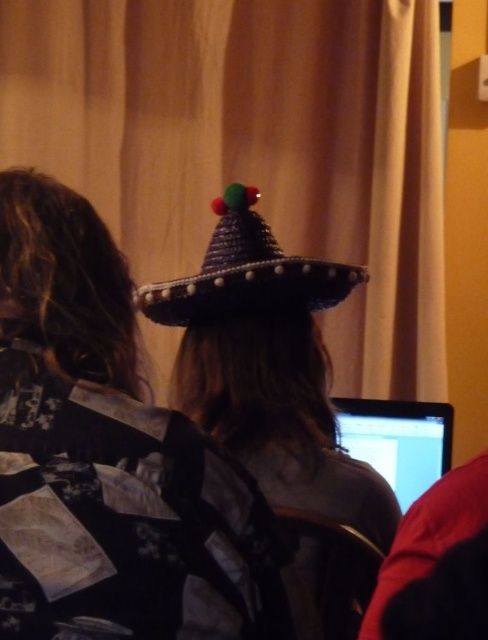
Question: Can you confirm if shiny metallic sombrero at center is bigger than woven straw sombrero at upper center?

Choices:
 (A) yes
 (B) no

Answer: (A)

Question: Among these objects, which one is farthest from the camera?

Choices:
 (A) matte black laptop at lower right
 (B) woven straw sombrero at upper center
 (C) shiny metallic sombrero at center
 (D) woven straw hat at center

Answer: (A)

Question: Can you confirm if woven straw hat at center is positioned to the right of shiny metallic sombrero at center?

Choices:
 (A) no
 (B) yes

Answer: (A)

Question: Which object is positioned closest to the matte black laptop at lower right?

Choices:
 (A) woven straw sombrero at upper center
 (B) shiny metallic sombrero at center

Answer: (B)

Question: From the image, what is the correct spatial relationship of woven straw hat at center in relation to matte black laptop at lower right?

Choices:
 (A) right
 (B) left

Answer: (B)

Question: Which point is farther from the camera taking this photo?

Choices:
 (A) (125, 493)
 (B) (232, 248)

Answer: (B)